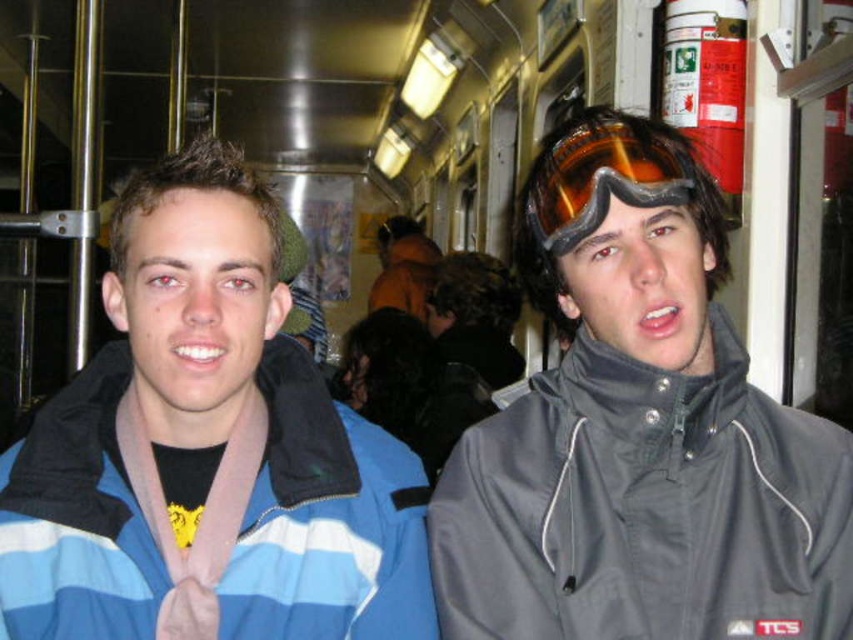
Question: Which of the following is the closest to the observer?

Choices:
 (A) gray matte jacket at center
 (B) blue striped jacket at center
 (C) orange reflective lens goggles at upper right

Answer: (B)

Question: Does blue striped jacket at center appear on the left side of orange reflective lens goggles at upper right?

Choices:
 (A) yes
 (B) no

Answer: (A)

Question: Which object is closer to the camera taking this photo?

Choices:
 (A) gray matte jacket at center
 (B) orange reflective lens goggles at upper right

Answer: (A)

Question: Does gray matte jacket at center have a smaller size compared to blue striped jacket at center?

Choices:
 (A) yes
 (B) no

Answer: (B)

Question: Can you confirm if gray matte jacket at center is wider than orange reflective lens goggles at upper right?

Choices:
 (A) yes
 (B) no

Answer: (A)

Question: Considering the real-world distances, which object is farthest from the blue striped jacket at center?

Choices:
 (A) orange reflective lens goggles at upper right
 (B) gray matte jacket at center

Answer: (A)